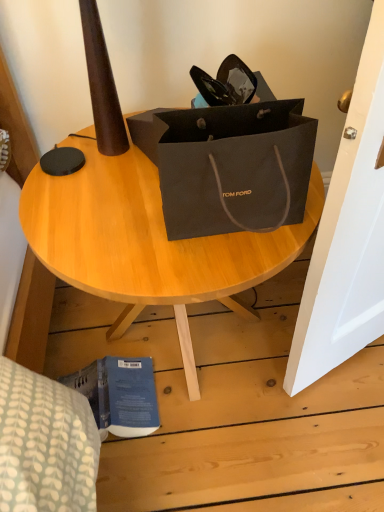
Locate an element on the screen. This screenshot has height=512, width=384. blank space above blue matte book at lower left (from a real-world perspective) is located at coordinates (105, 401).